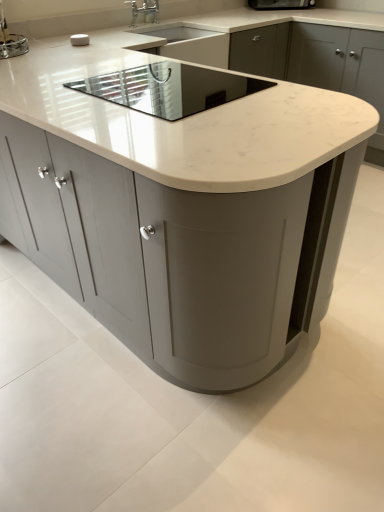
Question: Is satin nickel faucet at upper center not near chrome metallic faucet at upper center?

Choices:
 (A) yes
 (B) no

Answer: (B)

Question: Can you confirm if satin nickel faucet at upper center is positioned to the left of chrome metallic faucet at upper center?

Choices:
 (A) no
 (B) yes

Answer: (A)

Question: Can you confirm if satin nickel faucet at upper center is thinner than chrome metallic faucet at upper center?

Choices:
 (A) no
 (B) yes

Answer: (B)

Question: Is satin nickel faucet at upper center directly adjacent to chrome metallic faucet at upper center?

Choices:
 (A) no
 (B) yes

Answer: (B)

Question: From the image's perspective, is satin nickel faucet at upper center beneath chrome metallic faucet at upper center?

Choices:
 (A) yes
 (B) no

Answer: (B)

Question: From a real-world perspective, is satin nickel faucet at upper center physically above chrome metallic faucet at upper center?

Choices:
 (A) no
 (B) yes

Answer: (A)

Question: Is metallic silver toaster at upper left, placed as the 2th appliance when sorted from right to left, surrounded by chrome metallic faucet at upper center?

Choices:
 (A) yes
 (B) no

Answer: (B)

Question: Could you tell me if chrome metallic faucet at upper center is turned towards metallic silver toaster at upper left, positioned as the 1th appliance in back-to-front order?

Choices:
 (A) no
 (B) yes

Answer: (A)

Question: Is chrome metallic faucet at upper center closer to camera compared to metallic silver toaster at upper left, the first appliance viewed from the left?

Choices:
 (A) no
 (B) yes

Answer: (A)

Question: From a real-world perspective, is chrome metallic faucet at upper center beneath metallic silver toaster at upper left, the 2th appliance when ordered from bottom to top?

Choices:
 (A) no
 (B) yes

Answer: (A)

Question: Does chrome metallic faucet at upper center have a larger size compared to metallic silver toaster at upper left, arranged as the 2th appliance when viewed from the front?

Choices:
 (A) yes
 (B) no

Answer: (B)

Question: Can you confirm if chrome metallic faucet at upper center is shorter than metallic silver toaster at upper left, placed as the 2th appliance when sorted from right to left?

Choices:
 (A) no
 (B) yes

Answer: (A)

Question: Is metallic silver toaster at upper left, placed as the 2th appliance when sorted from right to left, wider than satin nickel faucet at upper center?

Choices:
 (A) yes
 (B) no

Answer: (A)